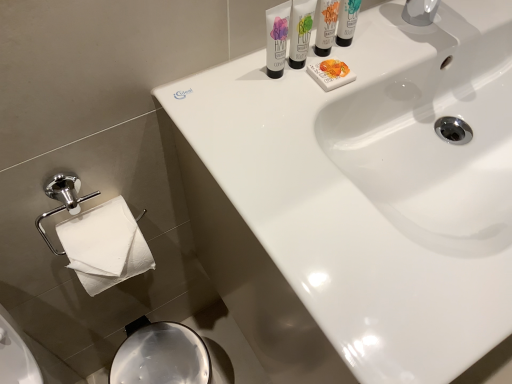
The height and width of the screenshot is (384, 512). What are the coordinates of `free space on the front side of matte white shaving cream at upper right, which is the 1th shaving cream in right-to-left order` in the screenshot? It's located at (302, 128).